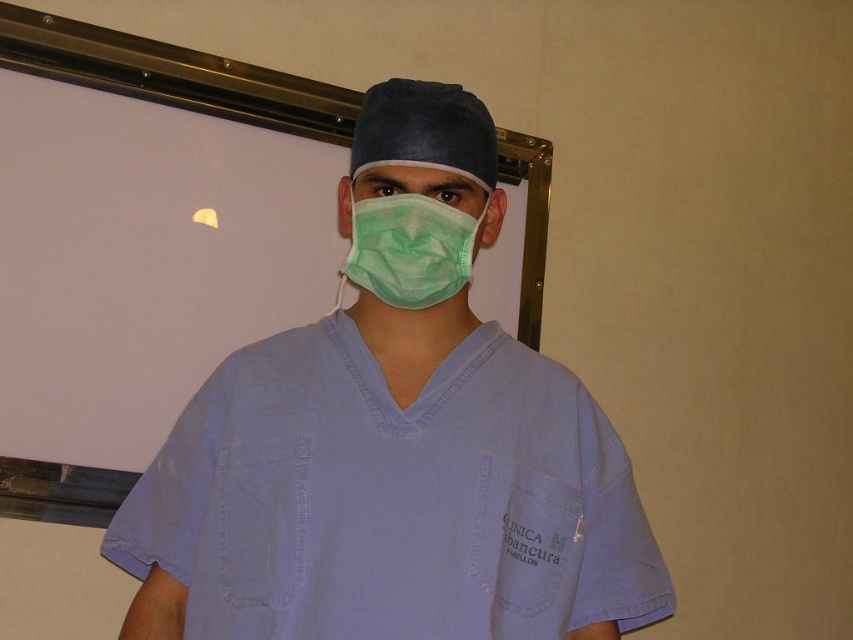
Does light blue scrubs at center have a smaller size compared to green matte mask at center?

Incorrect, light blue scrubs at center is not smaller in size than green matte mask at center.

Between point (189, 596) and point (466, 284), which one is positioned in front?

Point (189, 596) is more forward.

The width and height of the screenshot is (853, 640). What are the coordinates of `light blue scrubs at center` in the screenshot? It's located at (393, 442).